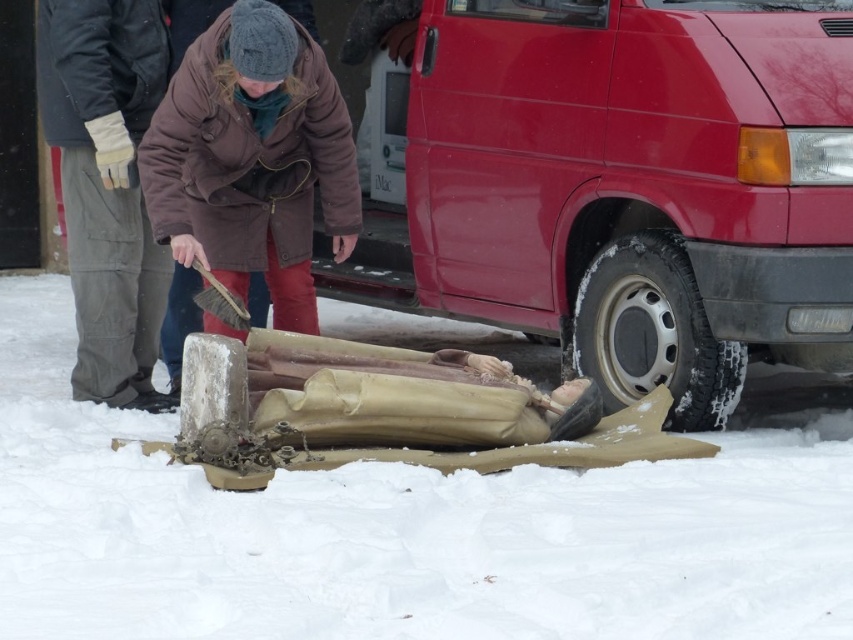
Question: Is white matte snow at center thinner than black rubber tire at lower right?

Choices:
 (A) yes
 (B) no

Answer: (B)

Question: Among these objects, which one is farthest from the camera?

Choices:
 (A) red matte van at center
 (B) white matte snow at center

Answer: (A)

Question: Which point is farther to the camera?

Choices:
 (A) (398, 481)
 (B) (703, 145)

Answer: (B)

Question: Can you confirm if white matte snow at center is thinner than gray woolen hat at upper left?

Choices:
 (A) yes
 (B) no

Answer: (B)

Question: Which point is farther from the camera taking this photo?

Choices:
 (A) (160, 35)
 (B) (86, 429)
 (C) (215, 284)
 (D) (775, 355)

Answer: (A)

Question: In this image, where is white matte snow at center located relative to black rubber tire at lower right?

Choices:
 (A) below
 (B) above

Answer: (A)